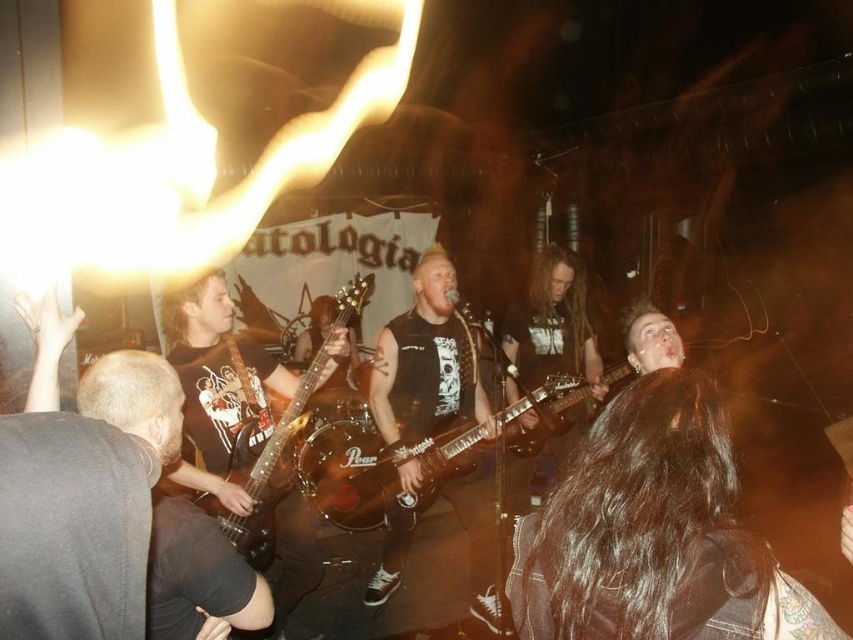
You are a photographer trying to capture a closeup shot of the shiny black electric guitar at center and the wooden electric guitar at center during the performance. Based on their sizes, which guitar should you focus on to ensure it fills the frame more effectively?

The shiny black electric guitar at center has a larger size compared to wooden electric guitar at center, so focusing on the shiny black electric guitar at center will fill the frame more effectively.

You are a photographer at the concert. You need to capture a closeup shot of the shiny black electric guitar at center and the wooden electric guitar at center. Which guitar should you zoom in on to ensure it fills the frame more without moving the camera?

The wooden electric guitar at center is taller than the shiny black electric guitar at center, so you should zoom in on the wooden electric guitar at center to fill the frame more without moving the camera.

In the live performance scene, you notice two guitars on stage. The shiny black electric guitar at center and the wooden electric guitar at center. Which guitar is wider?

The shiny black electric guitar at center is wider than the wooden electric guitar at center.